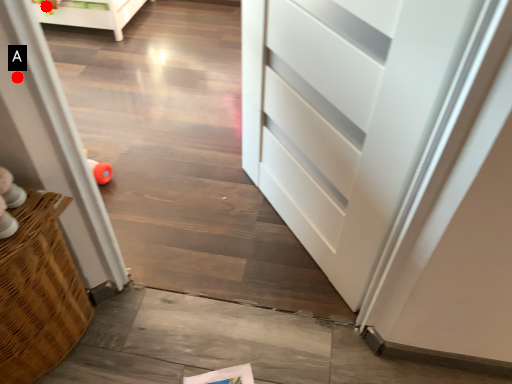
Question: Two points are circled on the image, labeled by A and B beside each circle. Which of the following is the farthest from the observer?

Choices:
 (A) A is further
 (B) B is further

Answer: (B)